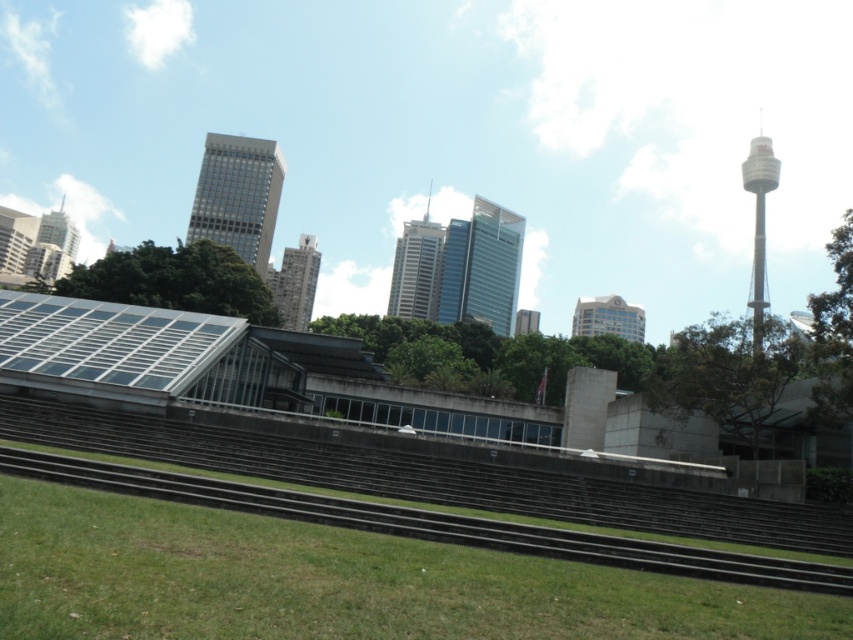
You are standing at a point in the urban landscape scene. You see two points marked as point 1 at coordinates point (486,291) and point 2 at coordinates point (292,248). Which point is closer to you?

Point (486,291) is in front of point (292,248), so it is closer to you.

You are standing at the grassy area in front of the tiered steps leading to the modern building. You notice a point marked at coordinates [36,244] in the image. Which object in the scene is located exactly at that point?

The matte glass skyscraper at upper left is located exactly at point [36,244].

You are standing at the base of the tiered steps in the urban landscape scene. You see two points marked in the image. Which point, point (x=61, y=244) or point (x=312, y=269), is closer to you?

Point (x=61, y=244) is closer to you because it is further to the viewer than point (x=312, y=269).